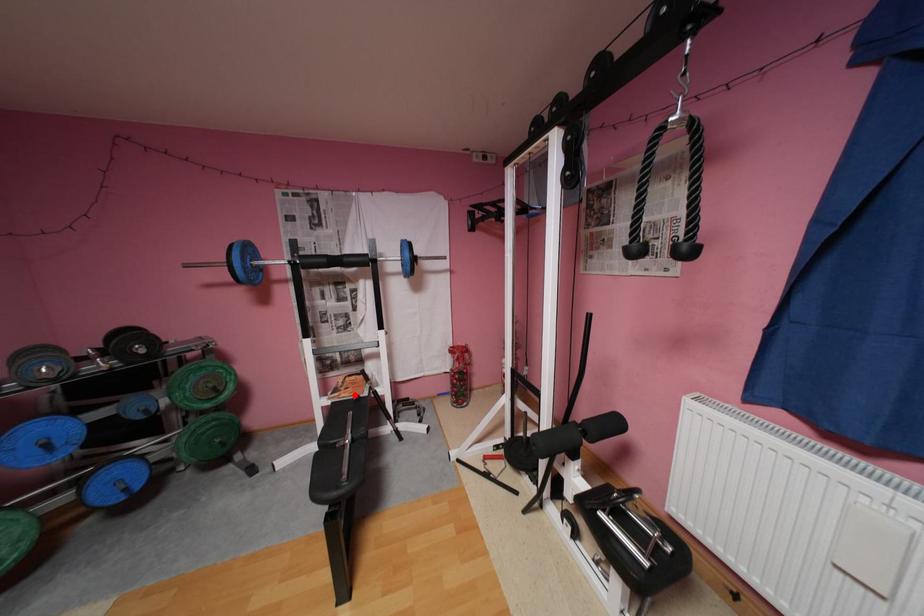
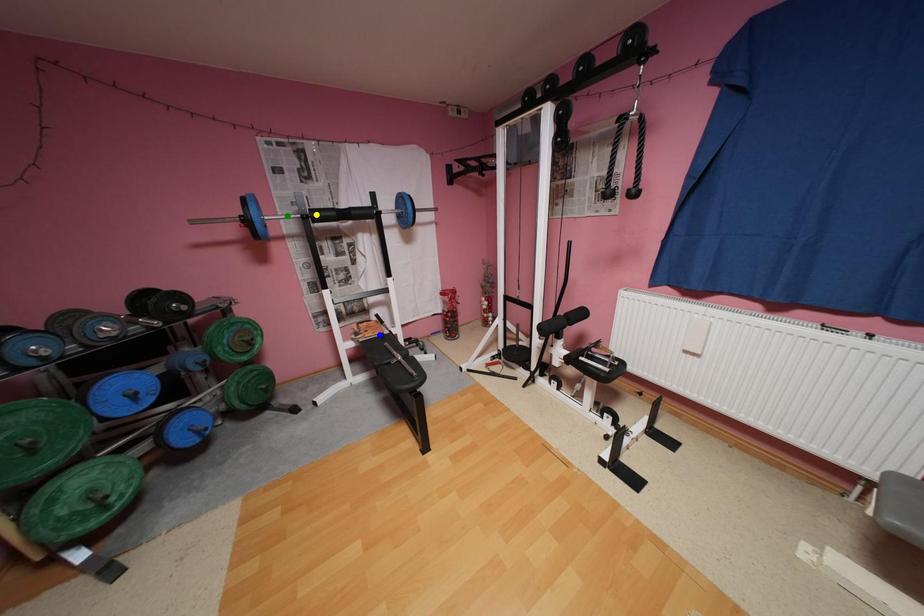
Question: I am providing you with two images of the same scene from different viewpoints. A red point is marked on the first image. You are given multiple points on the second image. Which spot in image 2 lines up with the point in image 1?

Choices:
 (A) green point
 (B) blue point
 (C) yellow point

Answer: (B)